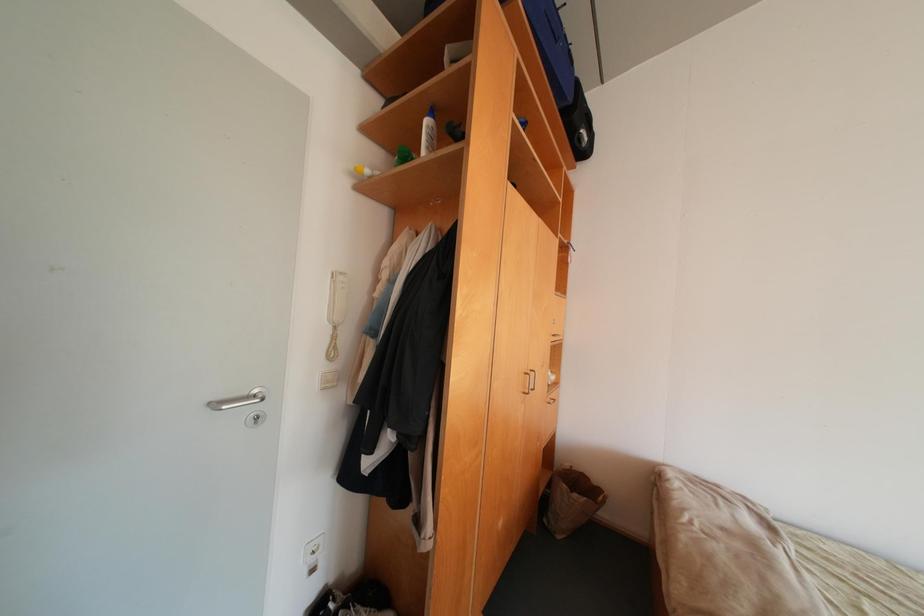
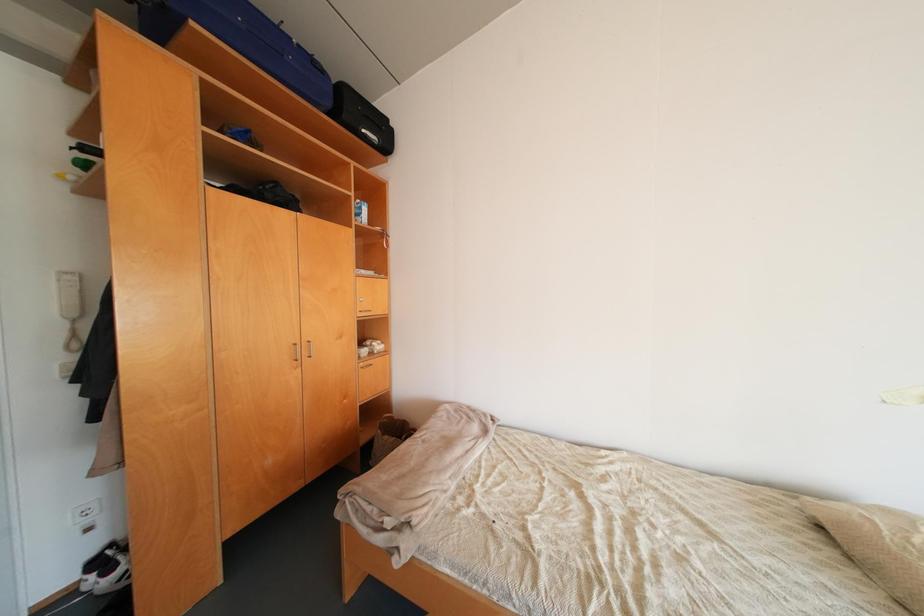
Question: In a continuous first-person perspective shot, in which direction is the camera moving?

Choices:
 (A) Left
 (B) Right
 (C) Forward
 (D) Backward

Answer: (B)